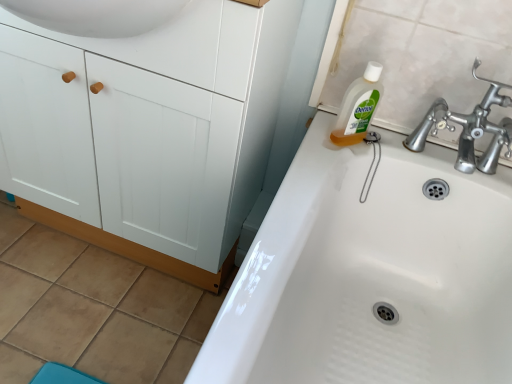
In order to face white glossy sink at upper right, should I rotate leftwards or rightwards?

Turn right approximately 15.874 degrees to face it.

Locate an element on the screen. The image size is (512, 384). white glossy sink at upper right is located at coordinates (377, 265).

Measure the distance between clear liquid soap at upper right and camera.

clear liquid soap at upper right and camera are 37.26 inches apart from each other.

I want to click on white matte cabinet at left, so click(x=147, y=132).

Are white glossy sink at upper right and clear liquid soap at upper right beside each other?

No, white glossy sink at upper right is not touching clear liquid soap at upper right.

Does white glossy sink at upper right have a greater width compared to clear liquid soap at upper right?

Yes, white glossy sink at upper right is wider than clear liquid soap at upper right.

From a real-world perspective, which is physically above, white glossy sink at upper right or clear liquid soap at upper right?

clear liquid soap at upper right, from a real-world perspective.

Is white glossy sink at upper right smaller than clear liquid soap at upper right?

Incorrect, white glossy sink at upper right is not smaller in size than clear liquid soap at upper right.

From the image's perspective, is clear liquid soap at upper right over white matte cabinet at left?

Yes, from the image's perspective, clear liquid soap at upper right is over white matte cabinet at left.

Is there a large distance between clear liquid soap at upper right and white matte cabinet at left?

Actually, clear liquid soap at upper right and white matte cabinet at left are a little close together.

Is clear liquid soap at upper right shorter than white matte cabinet at left?

Yes, clear liquid soap at upper right is shorter than white matte cabinet at left.

Consider the image. Which object is thinner, white matte cabinet at left or white glossy sink at upper right?

With smaller width is white matte cabinet at left.

Is white matte cabinet at left surrounding white glossy sink at upper right?

No, white glossy sink at upper right is not inside white matte cabinet at left.

From the picture: Between white matte cabinet at left and white glossy sink at upper right, which one has less height?

Standing shorter between the two is white glossy sink at upper right.

Based on their sizes in the image, would you say white matte cabinet at left is bigger or smaller than white glossy sink at upper right?

Considering their sizes, white matte cabinet at left takes up less space than white glossy sink at upper right.

Considering the relative sizes of white matte cabinet at left and clear liquid soap at upper right in the image provided, is white matte cabinet at left thinner than clear liquid soap at upper right?

Incorrect, the width of white matte cabinet at left is not less than that of clear liquid soap at upper right.

Considering the sizes of objects white matte cabinet at left and clear liquid soap at upper right in the image provided, who is bigger, white matte cabinet at left or clear liquid soap at upper right?

Bigger between the two is white matte cabinet at left.

In the scene shown: Do you think white matte cabinet at left is within clear liquid soap at upper right, or outside of it?

white matte cabinet at left is not enclosed by clear liquid soap at upper right.

From a real-world perspective, is white matte cabinet at left physically located above or below clear liquid soap at upper right?

In terms of real-world spatial position, white matte cabinet at left is below clear liquid soap at upper right.

Which is closer, (342, 130) or (465, 131)?

Point (342, 130).

In the scene shown: From the image's perspective, which one is positioned higher, clear liquid soap at upper right or white glossy sink at upper right?

From the image's view, clear liquid soap at upper right is above.

Between clear liquid soap at upper right and white glossy sink at upper right, which one has larger size?

Bigger between the two is white glossy sink at upper right.

Which of these two, white glossy sink at upper right or white matte cabinet at left, stands shorter?

white glossy sink at upper right is shorter.

Considering the points (332, 192) and (53, 192), which point is in front, point (332, 192) or point (53, 192)?

Point (332, 192)

From a real-world perspective, relative to white matte cabinet at left, is white glossy sink at upper right vertically above or below?

white glossy sink at upper right is situated lower than white matte cabinet at left in the real world.

Is white glossy sink at upper right far from white matte cabinet at left?

No.

Locate an element on the screen. The height and width of the screenshot is (384, 512). cleaning product above the white glossy sink at upper right (from the image's perspective) is located at coordinates (358, 107).

In order to click on cleaning product above the white matte cabinet at left (from a real-world perspective) in this screenshot , I will do `click(358, 107)`.

Based on their spatial positions, is clear liquid soap at upper right or white glossy sink at upper right closer to white matte cabinet at left?

Based on the image, white glossy sink at upper right appears to be nearer to white matte cabinet at left.

When comparing their distances from clear liquid soap at upper right, does white matte cabinet at left or white glossy sink at upper right seem further?

The object further to clear liquid soap at upper right is white matte cabinet at left.

Which object lies nearer to the anchor point white matte cabinet at left, white glossy sink at upper right or clear liquid soap at upper right?

white glossy sink at upper right lies closer to white matte cabinet at left than the other object.

Looking at this image, which object lies further to the anchor point clear liquid soap at upper right, white glossy sink at upper right or white matte cabinet at left?

Based on the image, white matte cabinet at left appears to be further to clear liquid soap at upper right.

Looking at the image, which one is located closer to white glossy sink at upper right, white matte cabinet at left or clear liquid soap at upper right?

Among the two, clear liquid soap at upper right is located nearer to white glossy sink at upper right.

Consider the image. Based on their spatial positions, is clear liquid soap at upper right or white matte cabinet at left further from white glossy sink at upper right?

Based on the image, white matte cabinet at left appears to be further to white glossy sink at upper right.

Image resolution: width=512 pixels, height=384 pixels. Identify the location of cleaning product between white matte cabinet at left and white glossy sink at upper right in the horizontal direction. (358, 107).